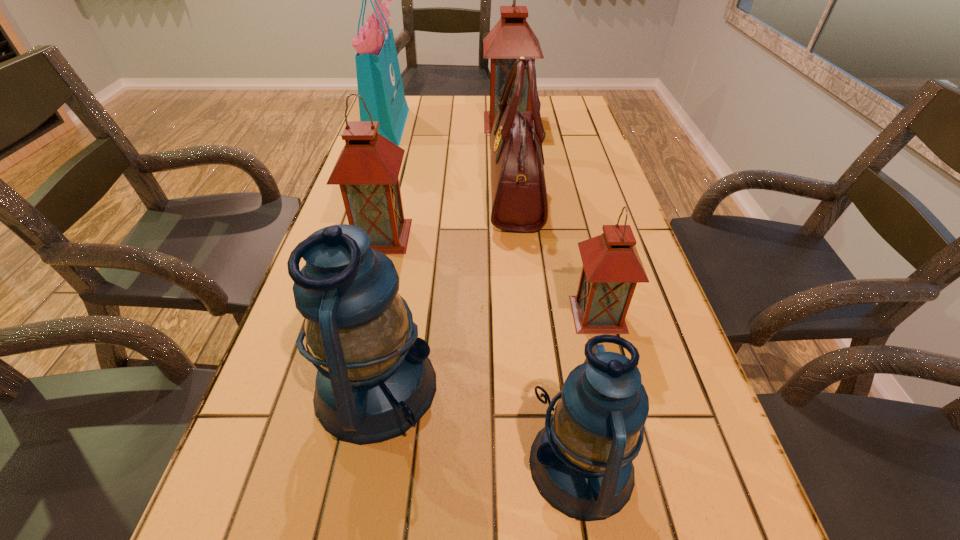
This screenshot has height=540, width=960. I want to click on free space located 0.290m on the front of the blue shopping bag, so click(364, 195).

I want to click on vacant space located on the front-facing side of the brown handbag, so click(416, 192).

Locate an element on the screen. The height and width of the screenshot is (540, 960). free space located 0.280m on the front-facing side of the brown handbag is located at coordinates (391, 192).

The height and width of the screenshot is (540, 960). Identify the location of vacant space situated on the front-facing side of the brown handbag. (468, 192).

The width and height of the screenshot is (960, 540). What are the coordinates of `free point located on the right of the leftmost pink lantern` in the screenshot? It's located at (540, 236).

In order to click on vacant space located 0.380m on the face of the left blue lantern in this screenshot , I will do pos(646,387).

Where is `vacant space situated on the face of the smaller blue lantern`? vacant space situated on the face of the smaller blue lantern is located at coordinates (365, 465).

The width and height of the screenshot is (960, 540). I want to click on blank area located 0.210m on the face of the smaller blue lantern, so click(x=396, y=465).

Find the location of a particular element. The image size is (960, 540). vacant space located 0.100m on the face of the smaller blue lantern is located at coordinates (467, 465).

Find the location of a particular element. vacant region located on the back of the smallest pink lantern is located at coordinates (578, 235).